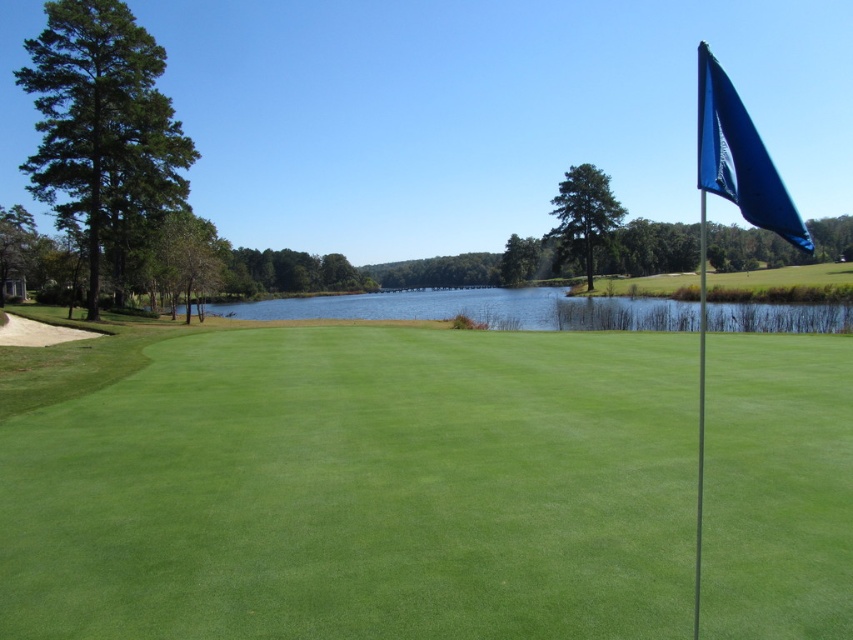
Image resolution: width=853 pixels, height=640 pixels. Identify the location of clear blue water at center. (480, 308).

Which is behind, point (370, 314) or point (746, 172)?

The point (370, 314) is more distant.

You are a GUI agent. You are given a task and a screenshot of the screen. Output one action in this format:
    pyautogui.click(x=<x>, y=<y>)
    Task: Click on the clear blue water at center
    The height and width of the screenshot is (640, 853).
    Given the screenshot: What is the action you would take?
    480,308

Who is positioned more to the left, green grass at center or blue fabric flag at upper right?

Positioned to the left is green grass at center.

Is green grass at center bigger than blue fabric flag at upper right?

No.

In order to click on green grass at center in this screenshot , I will do `click(358, 490)`.

Between point (730, 371) and point (640, 323), which one is positioned in front?

Point (730, 371) is in front.

Who is lower down, green grass at center or clear blue water at center?

Positioned lower is green grass at center.

Which is behind, point (476, 490) or point (222, 316)?

The point (222, 316) is more distant.

You are a GUI agent. You are given a task and a screenshot of the screen. Output one action in this format:
    pyautogui.click(x=<x>, y=<y>)
    Task: Click on the green grass at center
    This screenshot has width=853, height=640.
    Given the screenshot: What is the action you would take?
    pyautogui.click(x=358, y=490)